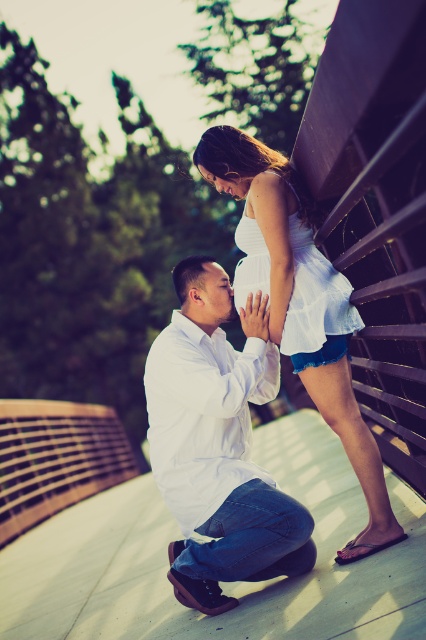
Question: Which of the following is the farthest from the observer?

Choices:
 (A) matte white belly at center
 (B) matte white forehead at upper center

Answer: (B)

Question: Among these points, which one is nearest to the camera?

Choices:
 (A) (190, 602)
 (B) (204, 280)
 (C) (189, 536)
 (D) (259, 257)

Answer: (A)

Question: Is white cotton shirt at lower center thinner than white cotton dress at upper center?

Choices:
 (A) no
 (B) yes

Answer: (B)

Question: Does white cotton dress at center have a smaller size compared to matte white forehead at upper center?

Choices:
 (A) no
 (B) yes

Answer: (A)

Question: Is white cotton shirt at lower center above matte white forehead at upper center?

Choices:
 (A) yes
 (B) no

Answer: (B)

Question: Which point is farther to the camera?

Choices:
 (A) (236, 163)
 (B) (236, 284)
 (C) (198, 275)

Answer: (C)